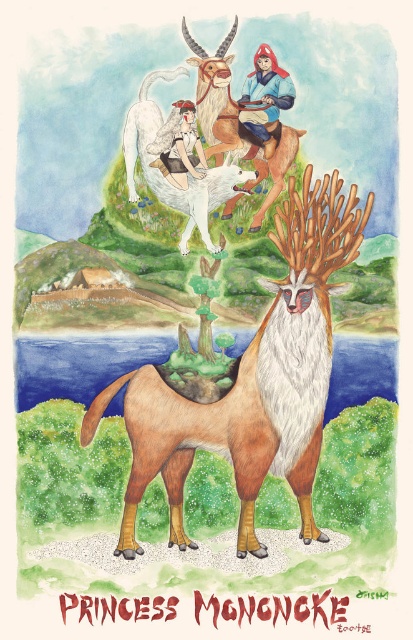
Question: Where is white fur antelope at upper center located in relation to matte blue santa claus at upper center in the image?

Choices:
 (A) right
 (B) left

Answer: (B)

Question: Which point is closer to the camera?

Choices:
 (A) smooth brown deer at upper center
 (B) matte white santa claus at upper center
 (C) brown velvet deer at center
 (D) matte blue santa claus at upper center

Answer: (C)

Question: Is brown velvet deer at center to the right of matte white santa claus at upper center from the viewer's perspective?

Choices:
 (A) yes
 (B) no

Answer: (A)

Question: Which point is closer to the camera taking this photo?

Choices:
 (A) (282, 212)
 (B) (192, 163)
 (C) (242, 96)

Answer: (A)

Question: Is brown velvet deer at center in front of matte white santa claus at upper center?

Choices:
 (A) no
 (B) yes

Answer: (B)

Question: Which point is farther to the camera?

Choices:
 (A) matte blue santa claus at upper center
 (B) matte white santa claus at upper center

Answer: (A)